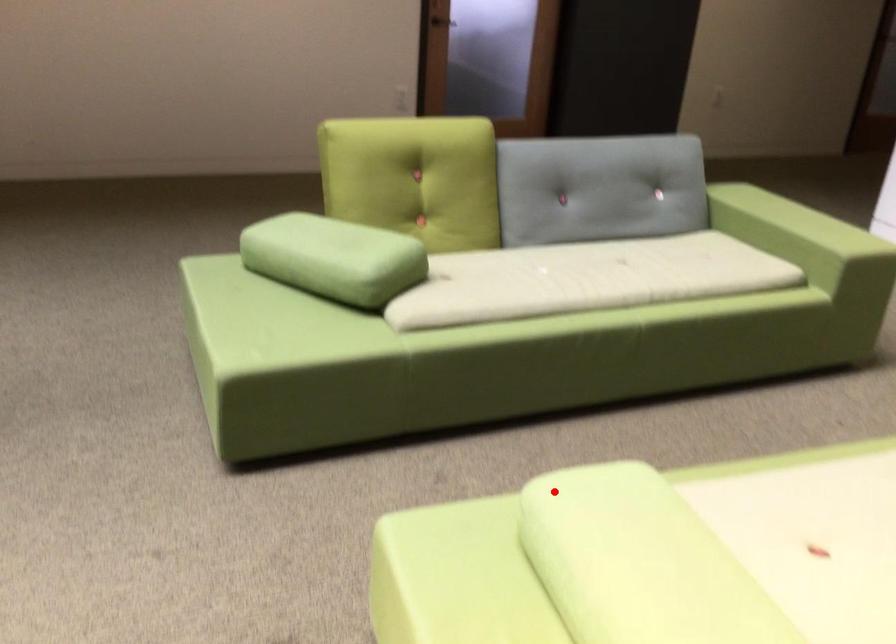
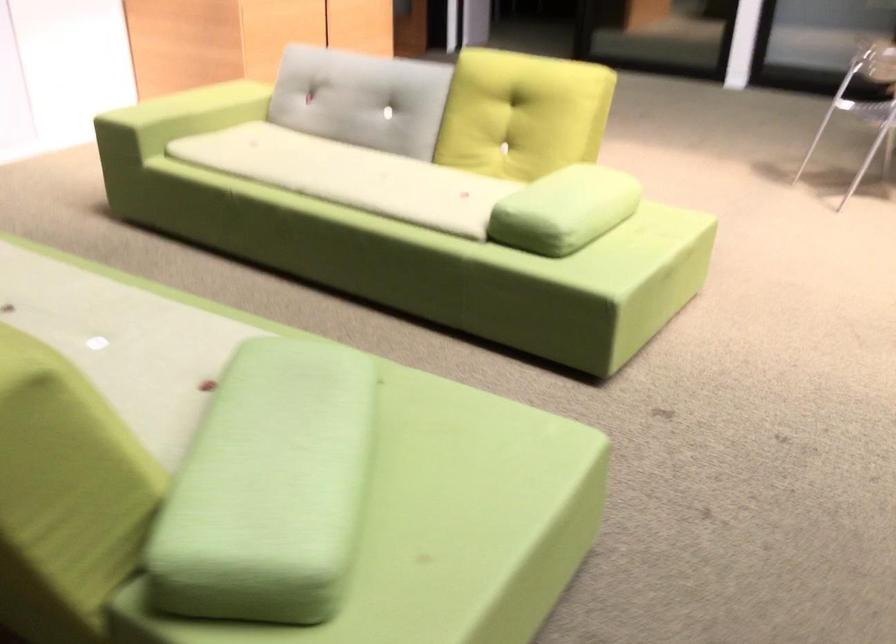
Find the pixel in the second image that matches the highlighted location in the first image.

(564, 210)